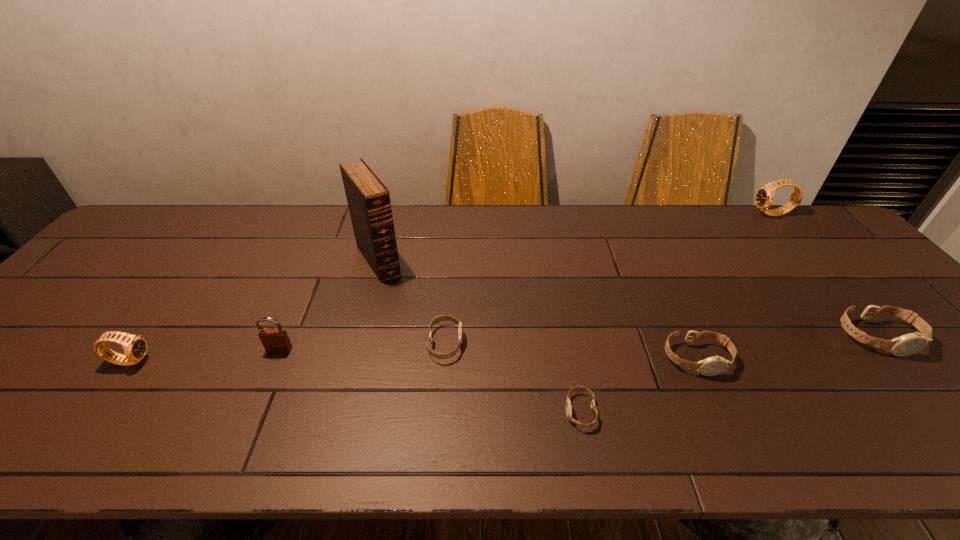
Select which beige watch is the second closest to the farthest object. Please provide its 2D coordinates. Your answer should be formatted as a tuple, i.e. [(x, y)], where the tuple contains the x and y coordinates of a point satisfying the conditions above.

[(711, 366)]

Locate which beige watch is the second closest to the right black watch. Please provide its 2D coordinates. Your answer should be formatted as a tuple, i.e. [(x, y)], where the tuple contains the x and y coordinates of a point satisfying the conditions above.

[(711, 366)]

The height and width of the screenshot is (540, 960). In order to click on free space that satisfies the following two spatial constraints: 1. on the face of the third object from right to left; 2. on the face of the left black watch in this screenshot , I will do `click(697, 361)`.

Where is `free location that satisfies the following two spatial constraints: 1. on the face of the farthest object; 2. on the face of the third shortest object`? This screenshot has width=960, height=540. free location that satisfies the following two spatial constraints: 1. on the face of the farthest object; 2. on the face of the third shortest object is located at coordinates (898, 359).

Identify the location of vacant region that satisfies the following two spatial constraints: 1. on the face of the farthest object; 2. on the face of the fourth tallest watch. (898, 359).

Where is `free location that satisfies the following two spatial constraints: 1. on the face of the third watch from right to left; 2. on the face of the second beige watch from left to right`? free location that satisfies the following two spatial constraints: 1. on the face of the third watch from right to left; 2. on the face of the second beige watch from left to right is located at coordinates (720, 411).

Where is `free spot that satisfies the following two spatial constraints: 1. on the face of the farthest watch; 2. on the face of the second biggest beige watch`? This screenshot has height=540, width=960. free spot that satisfies the following two spatial constraints: 1. on the face of the farthest watch; 2. on the face of the second biggest beige watch is located at coordinates (898, 359).

The height and width of the screenshot is (540, 960). I want to click on free space that satisfies the following two spatial constraints: 1. on the face of the rightmost beige watch; 2. on the face of the leftmost object, so click(x=898, y=361).

Identify the location of vacant space that satisfies the following two spatial constraints: 1. on the face of the fourth shortest watch; 2. on the face of the fourth object from right to left. (942, 411).

Locate an element on the screen. vacant area that satisfies the following two spatial constraints: 1. on the face of the tallest watch; 2. on the face of the second biggest beige watch is located at coordinates (898, 359).